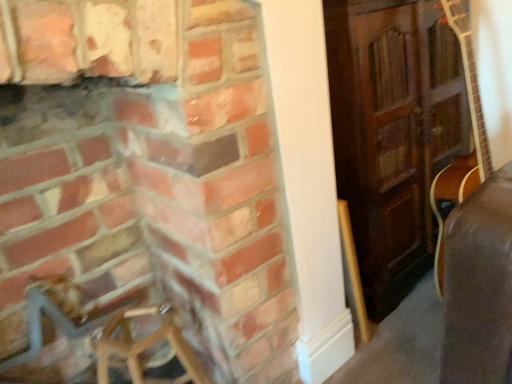
Question: From a real-world perspective, relative to wooden armchair at lower left, is brick fireplace at left vertically above or below?

Choices:
 (A) below
 (B) above

Answer: (B)

Question: Choose the correct answer: Is brick fireplace at left inside wooden armchair at lower left or outside it?

Choices:
 (A) outside
 (B) inside

Answer: (A)

Question: Does point (270, 309) appear closer or farther from the camera than point (48, 339)?

Choices:
 (A) farther
 (B) closer

Answer: (B)

Question: In the image, is wooden armchair at lower left positioned in front of or behind brick fireplace at left?

Choices:
 (A) behind
 (B) front

Answer: (A)

Question: Considering the positions of wooden armchair at lower left and brick fireplace at left in the image, is wooden armchair at lower left taller or shorter than brick fireplace at left?

Choices:
 (A) short
 (B) tall

Answer: (A)

Question: Looking at their shapes, would you say wooden armchair at lower left is wider or thinner than brick fireplace at left?

Choices:
 (A) wide
 (B) thin

Answer: (B)

Question: Considering the positions of wooden armchair at lower left and brick fireplace at left in the image, is wooden armchair at lower left bigger or smaller than brick fireplace at left?

Choices:
 (A) big
 (B) small

Answer: (B)